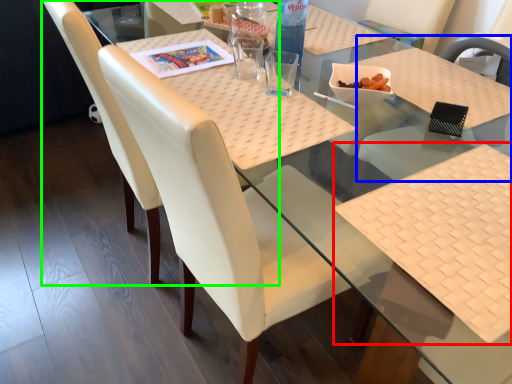
Question: Based on their relative distances, which object is nearer to place mat (highlighted by a red box)? Choose from chair (highlighted by a blue box) and chair (highlighted by a green box).

Choices:
 (A) chair
 (B) chair

Answer: (A)